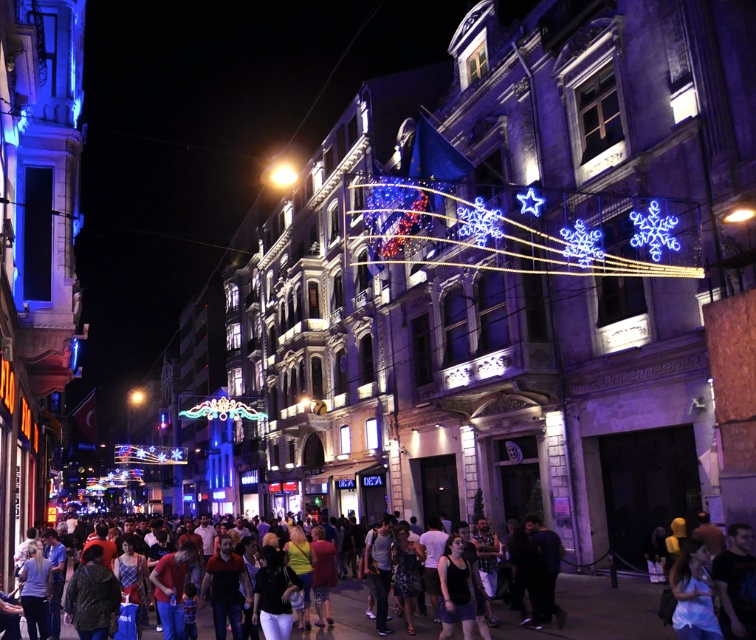
You are standing at the edge of the street in the urban scene. You notice a point marked at coordinates (346, 612). What is located at this point?

The point at coordinates (346, 612) marks multicolored casual clothing at center.

You are a photographer trying to capture the festive atmosphere of the street. You notice the illuminated plastic snowflake at center and the multicolored casual clothing at center. Which object should you focus on to highlight the festive decorations in your photo?

The illuminated plastic snowflake at center has a larger size compared to multicolored casual clothing at center, so focusing on the illuminated plastic snowflake at center would better highlight the festive decorations due to its prominence in size.

You are a photographer trying to capture the festive atmosphere of the street. You notice the multicolored casual clothing at center and the bright yellow light at center. Which object is closer to your camera lens?

The multicolored casual clothing at center is closer to the camera lens because it is in front of the bright yellow light at center.